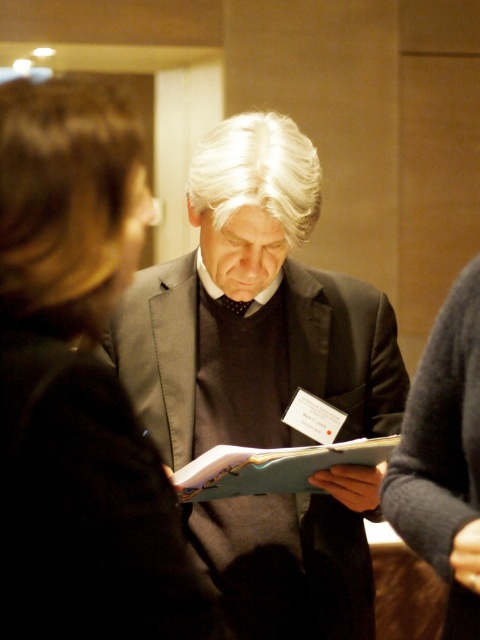
Question: Which object appears closest to the camera in this image?

Choices:
 (A) matte black suit at center
 (B) dark brown leather jacket at left

Answer: (B)

Question: Is matte black suit at center bigger than dark brown leather jacket at left?

Choices:
 (A) yes
 (B) no

Answer: (A)

Question: Is matte black suit at center to the left of blue matte folder at center from the viewer's perspective?

Choices:
 (A) no
 (B) yes

Answer: (B)

Question: Among these points, which one is farthest from the camera?

Choices:
 (A) (294, 628)
 (B) (137, 224)

Answer: (A)

Question: Among these points, which one is nearest to the camera?

Choices:
 (A) (252, 449)
 (B) (212, 330)

Answer: (A)

Question: Does dark brown leather jacket at left come in front of blue matte folder at center?

Choices:
 (A) no
 (B) yes

Answer: (B)